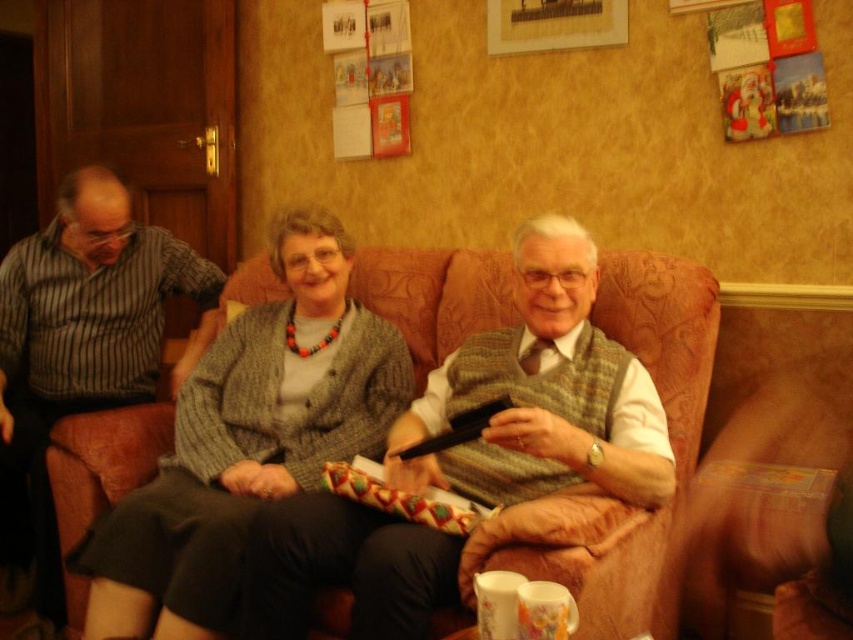
Looking at this image, you are a photographer setting up a shoot in this living room. You need to position a light source to the left of the striped fabric shirt at left and to the right of the knitted gray sweater at center. Is this possible given their positions?

The knitted gray sweater at center is to the right of the striped fabric shirt at left. Therefore, placing a light source to the left of the striped fabric shirt at left would be further left than the sweater, and to the right of the sweater would be between them. Since the sweater is already to the right of the shirt, the light cannot be both left of the shirt and right of the sweater simultaneously.

You are planning to place a decorative pillow on the brown fabric couch at center. Considering the size of the striped fabric shirt at left, will the pillow fit comfortably on the couch?

The brown fabric couch at center is wider than the striped fabric shirt at left, so the pillow should fit comfortably on the couch.

Looking at this image, you are trying to decide whether to place a tall floor lamp next to the brown fabric couch at center. Based on the scene, will the lamp be taller than the striped fabric shirt at left?

The brown fabric couch at center is not as tall as striped fabric shirt at left, so the lamp placed next to it might be taller than the striped fabric shirt at left depending on the lamp height.